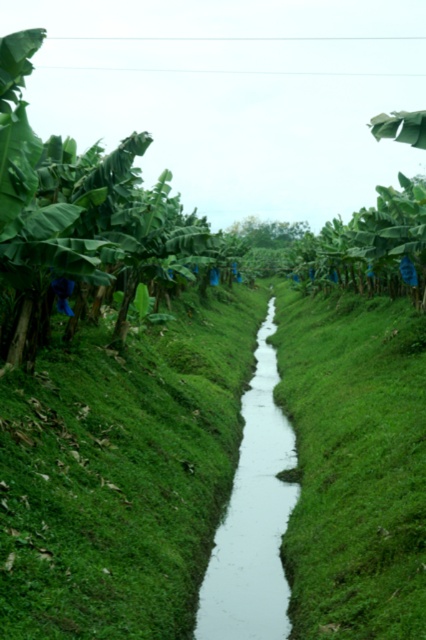
How far apart are green grass at center and white smooth stream at center?

green grass at center and white smooth stream at center are 1.63 meters apart.

Does point (176, 522) come in front of point (250, 554)?

Yes.

Which is behind, point (325, 513) or point (261, 445)?

Positioned behind is point (261, 445).

Locate an element on the screen. This screenshot has height=640, width=426. green grass at center is located at coordinates 120,476.

Is green grass at center taller than green leafy banana tree at left?

Incorrect, green grass at center's height is not larger of green leafy banana tree at left's.

Does point (149, 460) lie in front of point (8, 70)?

That is False.

Identify the location of green grass at center. (120, 476).

Image resolution: width=426 pixels, height=640 pixels. What do you see at coordinates (78, 211) in the screenshot?
I see `green leafy banana tree at left` at bounding box center [78, 211].

Who is higher up, green leafy banana tree at left or white smooth stream at center?

green leafy banana tree at left

Between point (57, 164) and point (264, 625), which one is positioned in front?

Positioned in front is point (264, 625).

What are the coordinates of `green leafy banana tree at left` in the screenshot? It's located at coord(78,211).